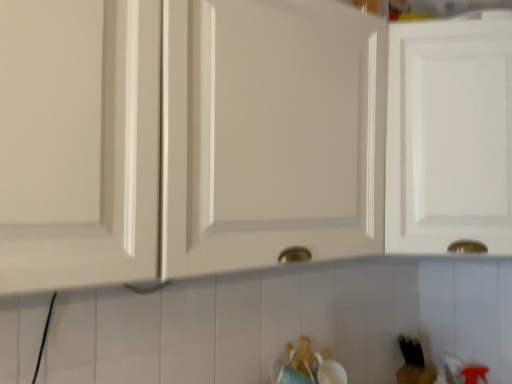
Question: From a real-world perspective, relative to brown plush bear at lower center, the 2th toy when ordered from right to left, is white glossy cabinet at center, the second cabinetry when ordered from right to left, vertically above or below?

Choices:
 (A) above
 (B) below

Answer: (A)

Question: Considering the relative positions of white glossy cabinet at center, the second cabinetry when ordered from right to left, and brown plush bear at lower center, positioned as the second toy in back-to-front order, in the image provided, is white glossy cabinet at center, the second cabinetry when ordered from right to left, to the left or to the right of brown plush bear at lower center, positioned as the second toy in back-to-front order,?

Choices:
 (A) right
 (B) left

Answer: (B)

Question: Which object is the farthest from the brown plush bear at lower center, placed as the second toy when sorted from bottom to top?

Choices:
 (A) white glossy cabinet at center, the second cabinetry when ordered from right to left
 (B) white glossy cabinet door at upper right, the first cabinetry when ordered from right to left
 (C) black matte bear at lower right, which appears as the 1th toy when viewed from the right

Answer: (B)

Question: Which object is the closest to the white glossy cabinet door at upper right, the first cabinetry when ordered from right to left?

Choices:
 (A) white glossy cabinet at center, the first cabinetry positioned from the left
 (B) black matte bear at lower right, positioned as the 2th toy in left-to-right order
 (C) brown plush bear at lower center, the 2th toy when ordered from right to left

Answer: (A)